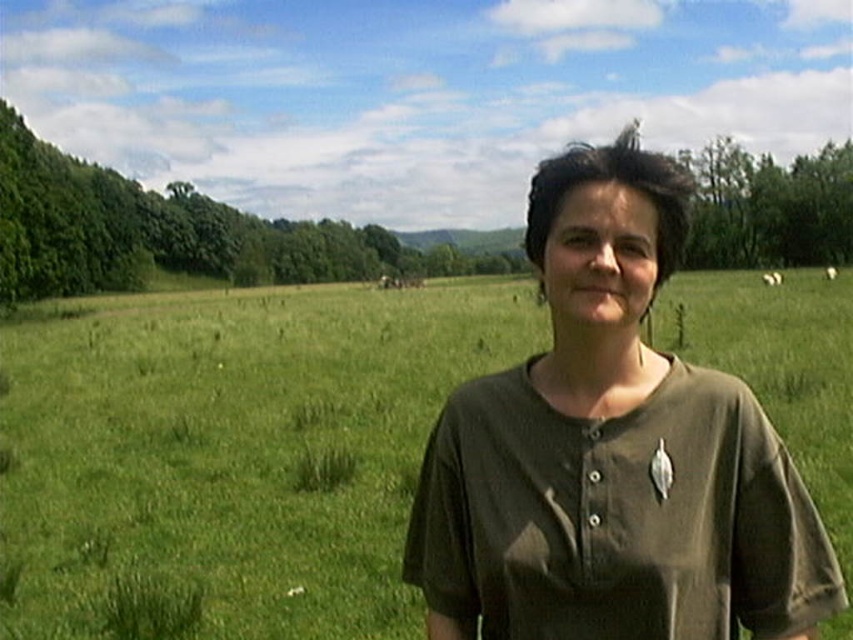
You are standing in the grassy field and want to walk from point A to point B. Point A is located at coordinates point [242,492] and point B is at point [581,592]. Since you can only move forward, which direction should you face to reach point B from point A?

Since point [242,492] is closer to you than point [581,592], you should face towards the direction of point [581,592], which is further away, to move forward from point A to point B.